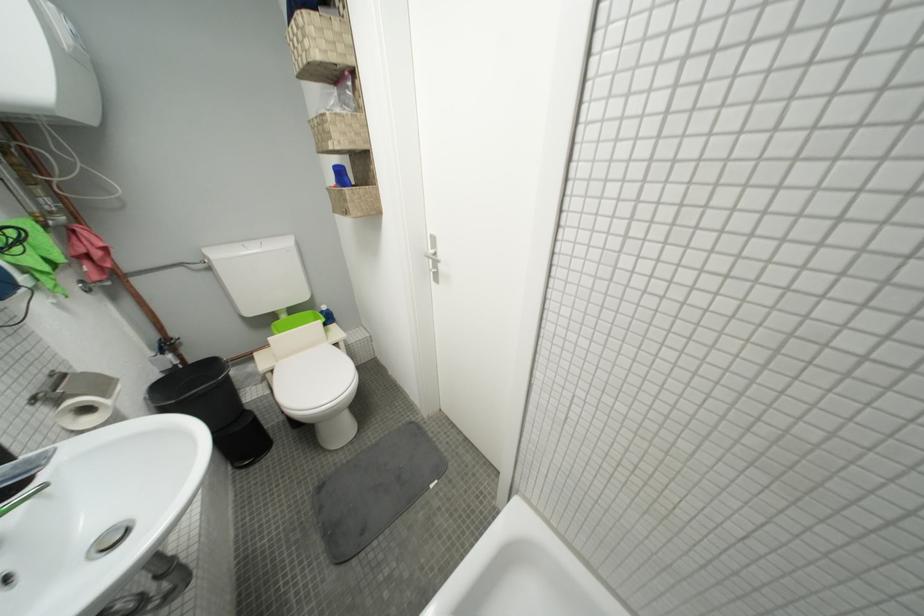
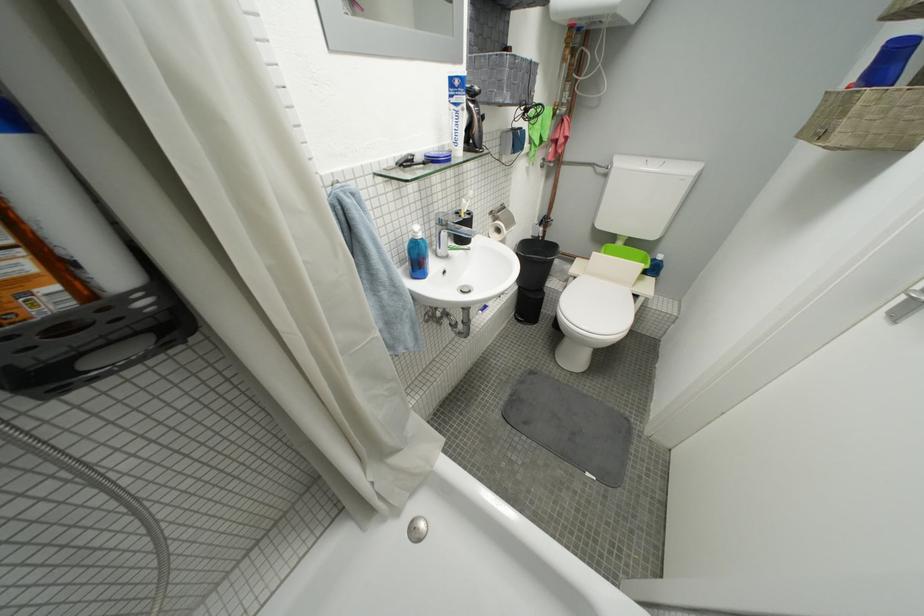
Find the pixel in the second image that matches (x=281, y=373) in the first image.

(584, 281)